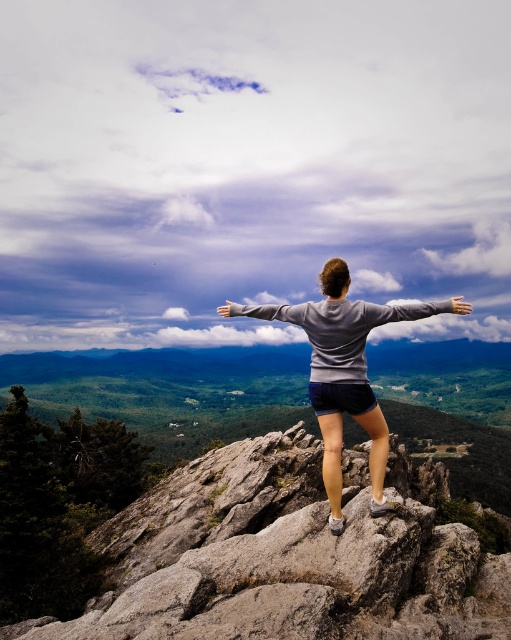
You are a photographer trying to capture the scene of a person embracing the landscape. You notice the gray sweatshirt at upper center and the gray matte hand at center. Which object is positioned to the right of the other?

The gray sweatshirt at upper center is to the right of the gray matte hand at center according to the description.

You are a photographer positioned at the camera location. You want to capture a closeup shot of the gray sweatshirt at upper center. Given that your camera has a minimum focusing distance of 5 meters, can you take the photo?

The distance between the gray sweatshirt at upper center and the camera is 10.02 meters, which is beyond the camera minimum focusing distance of 5 meters. Therefore, you can take the closeup shot.